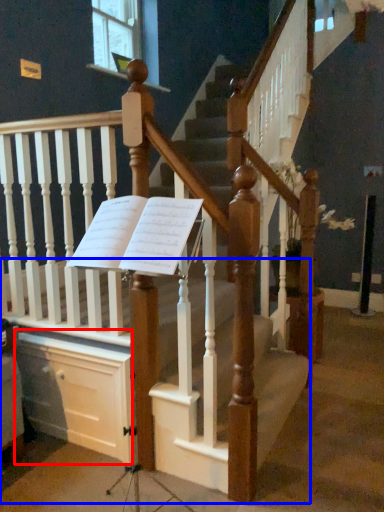
Question: Among these objects, which one is farthest to the camera, drawer (highlighted by a red box) or stairs (highlighted by a blue box)?

Choices:
 (A) drawer
 (B) stairs

Answer: (A)